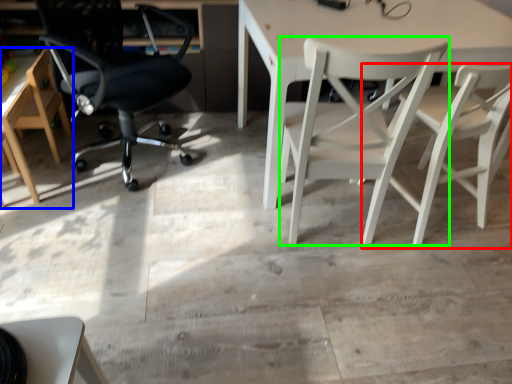
Question: Which is nearer to the chair (highlighted by a red box)? chair (highlighted by a blue box) or chair (highlighted by a green box).

Choices:
 (A) chair
 (B) chair

Answer: (B)